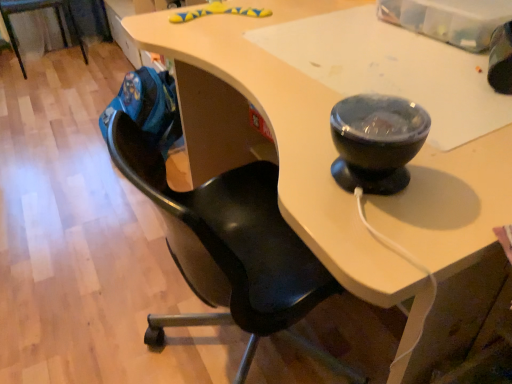
Question: In terms of size, does black matte chair at center, which is counted as the 1th chair, starting from the bottom, appear bigger or smaller than black leather chair at left, positioned as the first chair in left-to-right order?

Choices:
 (A) big
 (B) small

Answer: (A)

Question: Considering the relative positions of black matte chair at center, which is counted as the 1th chair, starting from the bottom, and black leather chair at left, the second chair viewed from the right, in the image provided, is black matte chair at center, which is counted as the 1th chair, starting from the bottom, to the left or to the right of black leather chair at left, the second chair viewed from the right,?

Choices:
 (A) right
 (B) left

Answer: (A)

Question: From a real-world perspective, is black matte chair at center, the 2th chair from the left, above or below black leather chair at left, which is counted as the 1th chair, starting from the back?

Choices:
 (A) below
 (B) above

Answer: (B)

Question: Choose the correct answer: Is black leather chair at left, which is counted as the 1th chair, starting from the back, inside black matte chair at center, which is counted as the 1th chair, starting from the bottom, or outside it?

Choices:
 (A) outside
 (B) inside

Answer: (A)

Question: From a real-world perspective, is black leather chair at left, which is counted as the 1th chair, starting from the back, physically located above or below black matte chair at center, which is counted as the 2th chair, starting from the back?

Choices:
 (A) below
 (B) above

Answer: (A)

Question: Considering the positions of black leather chair at left, positioned as the first chair in left-to-right order, and black matte chair at center, which is counted as the first chair, starting from the front, in the image, is black leather chair at left, positioned as the first chair in left-to-right order, taller or shorter than black matte chair at center, which is counted as the first chair, starting from the front,?

Choices:
 (A) tall
 (B) short

Answer: (B)

Question: Considering the positions of black leather chair at left, which is the first chair from top to bottom, and black matte chair at center, which is counted as the 1th chair, starting from the right, in the image, is black leather chair at left, which is the first chair from top to bottom, wider or thinner than black matte chair at center, which is counted as the 1th chair, starting from the right,?

Choices:
 (A) wide
 (B) thin

Answer: (A)